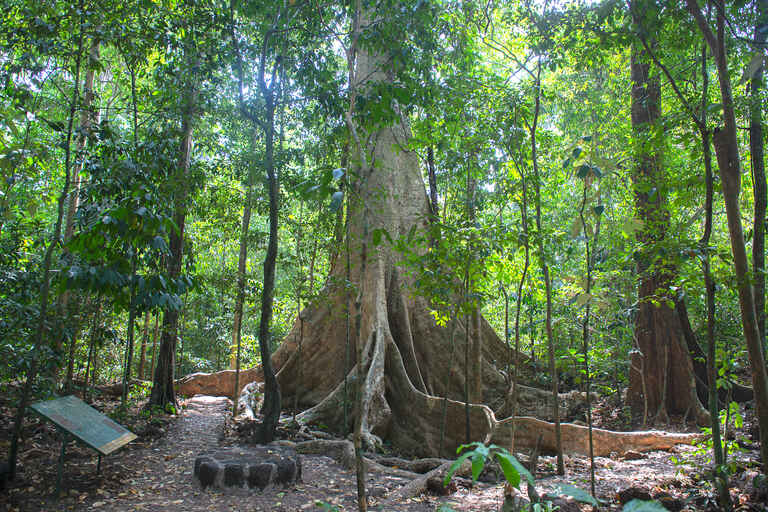
This screenshot has width=768, height=512. In order to click on plaque in this screenshot , I will do `click(53, 436)`.